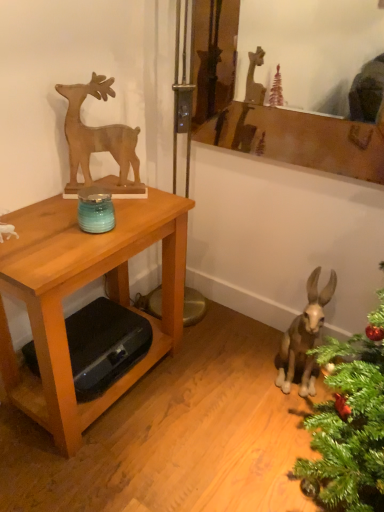
At what (x,y) coordinates should I click in order to perform the action: click on free point below brown matte donkey at lower right (from a real-world perspective). Please return your answer as a coordinate pair (x, y). Looking at the image, I should click on (290, 389).